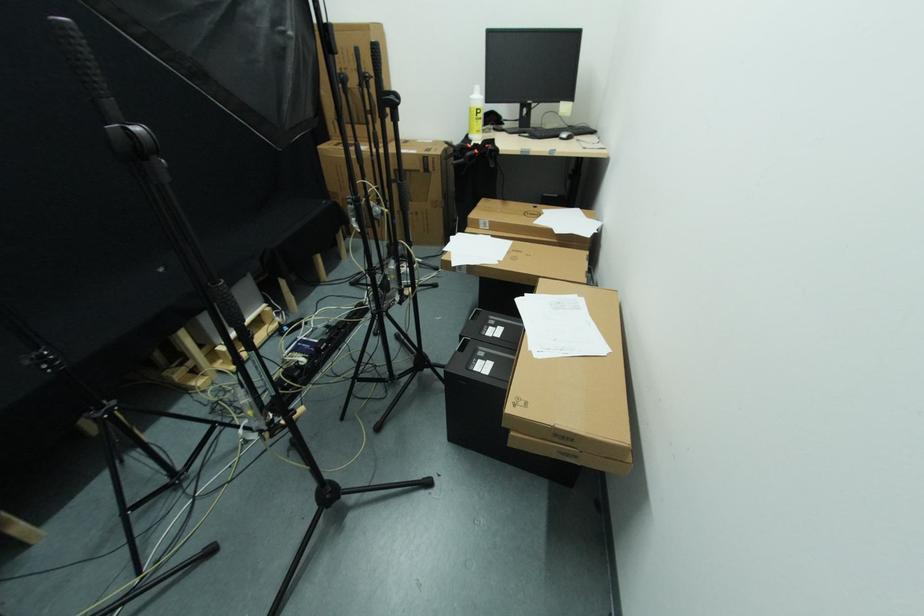
The width and height of the screenshot is (924, 616). I want to click on black computer tower, so click(x=480, y=382).